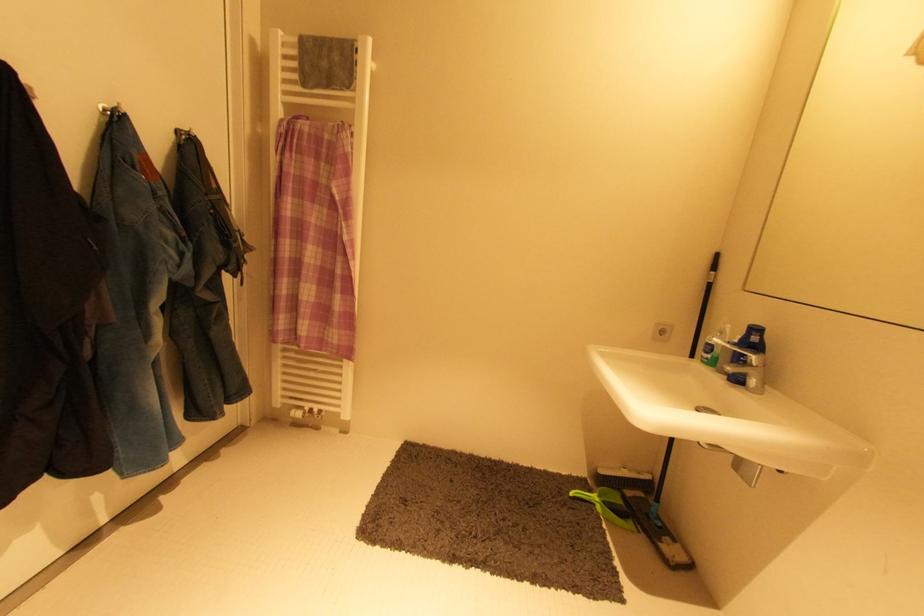
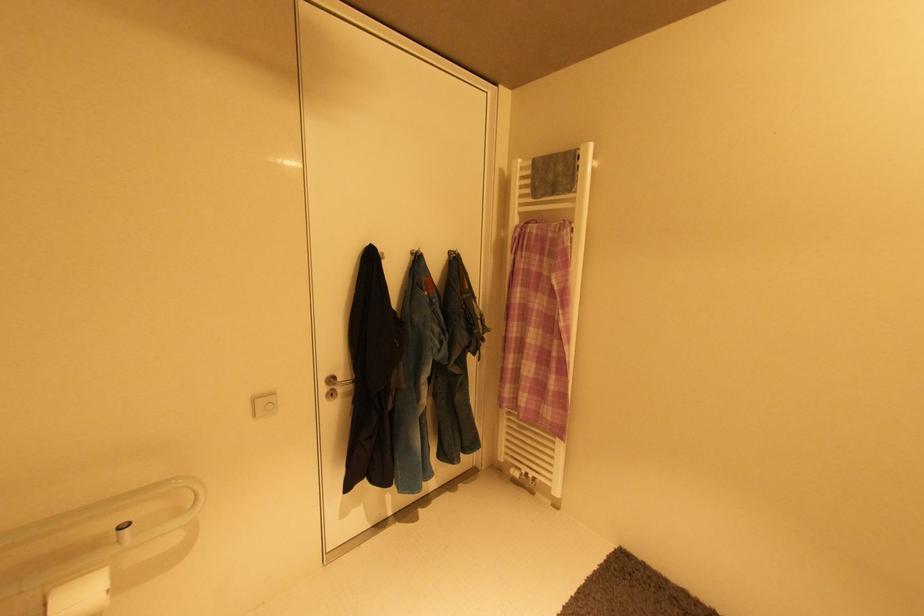
Question: The camera is either moving clockwise (left) or counter-clockwise (right) around the object. The first image is from the beginning of the video and the second image is from the end. Is the camera moving left or right when shooting the video?

Choices:
 (A) Left
 (B) Right

Answer: (B)